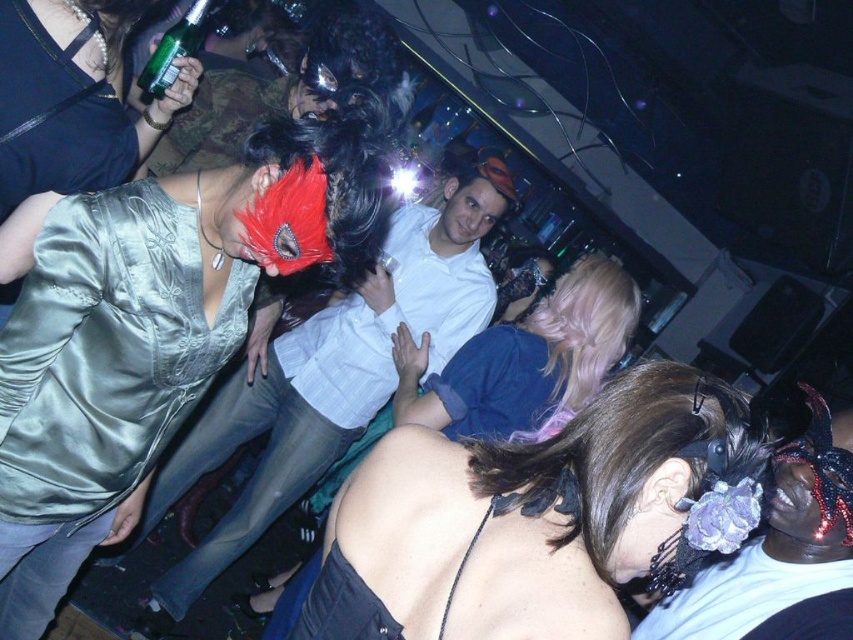
You are a photographer at the event and want to capture a closeup shot of the satin mask at upper left without moving the camera. Can you zoom in enough to get a clear image of it?

The satin mask at upper left is 1.25 meters away from the camera, so yes, you can zoom in to capture a clear closeup shot of it without moving the camera.

From the picture: You are organizing a fashion show and need to arrange two dresses based on their sizes. The satin black dress at center and the satin silver dress at upper left are available. Which dress should be placed first if you want to display them from smallest to largest?

The satin black dress at center should be placed first because it has a smaller size compared to the satin silver dress at upper left.

You are at a party and want to know how far you are from the point marked as point (550, 628). Can you determine the distance in inches?

The distance between you and point (550, 628) is 34.53 inches.